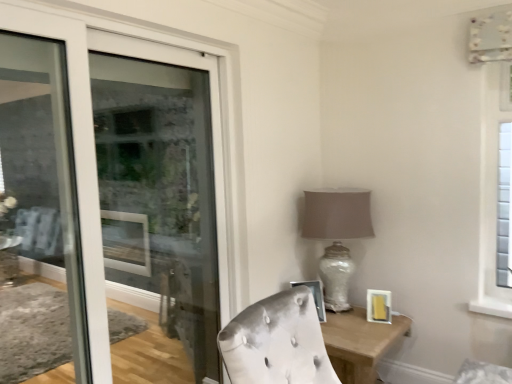
Measure the distance between point (354, 378) and camera.

A distance of 2.19 meters exists between point (354, 378) and camera.

This screenshot has width=512, height=384. Describe the element at coordinates (378, 306) in the screenshot. I see `matte gold picture frame at lower right, which is the 1th picture frame from right to left` at that location.

Measure the distance between metallic silver picture frame at center, arranged as the 2th picture frame when viewed from the right, and camera.

metallic silver picture frame at center, arranged as the 2th picture frame when viewed from the right, is 2.48 meters away from camera.

Image resolution: width=512 pixels, height=384 pixels. In order to click on wooden table at lower right in this screenshot , I will do tap(359, 343).

Identify the location of table that is under the matte glass door at left (from a real-world perspective). (359, 343).

From the image's perspective, would you say wooden table at lower right is positioned over matte glass door at left?

No, from the image's perspective, wooden table at lower right is not above matte glass door at left.

Are wooden table at lower right and matte glass door at left making contact?

There is a gap between wooden table at lower right and matte glass door at left.

Can we say wooden table at lower right lies outside matte glass door at left?

That's correct, wooden table at lower right is outside of matte glass door at left.

Is matte glass table lamp at center-right completely or partially outside of wooden table at lower right?

Yes, matte glass table lamp at center-right is located beyond the bounds of wooden table at lower right.

Is matte glass table lamp at center-right bigger than wooden table at lower right?

No.

From the image's perspective, is matte glass table lamp at center-right under wooden table at lower right?

No, from the image's perspective, matte glass table lamp at center-right is not beneath wooden table at lower right.

How different are the orientations of matte glass table lamp at center-right and wooden table at lower right in degrees?

There is a 1.27-degree angle between the facing directions of matte glass table lamp at center-right and wooden table at lower right.

Are matte glass door at left and matte glass table lamp at center-right located far from each other?

No, matte glass door at left is in close proximity to matte glass table lamp at center-right.

Considering the relative sizes of matte glass door at left and matte glass table lamp at center-right in the image provided, is matte glass door at left taller than matte glass table lamp at center-right?

Indeed, matte glass door at left has a greater height compared to matte glass table lamp at center-right.

From the image's perspective, which is below, matte glass door at left or matte glass table lamp at center-right?

matte glass table lamp at center-right, from the image's perspective.

Can we say matte glass door at left lies outside matte glass table lamp at center-right?

Yes, matte glass door at left is located beyond the bounds of matte glass table lamp at center-right.

Based on the photo, who is more distant, matte glass table lamp at center-right or matte gold picture frame at lower right, which is the 1th picture frame from right to left?

matte gold picture frame at lower right, which is the 1th picture frame from right to left, is further away from the camera.

Would you say matte glass table lamp at center-right is inside or outside matte gold picture frame at lower right, acting as the second picture frame starting from the left?

matte glass table lamp at center-right is not enclosed by matte gold picture frame at lower right, acting as the second picture frame starting from the left.

Is matte glass table lamp at center-right oriented towards matte gold picture frame at lower right, acting as the second picture frame starting from the left?

No, matte glass table lamp at center-right does not turn towards matte gold picture frame at lower right, acting as the second picture frame starting from the left.

Is matte glass table lamp at center-right wider or thinner than matte gold picture frame at lower right, acting as the second picture frame starting from the left?

Considering their sizes, matte glass table lamp at center-right looks broader than matte gold picture frame at lower right, acting as the second picture frame starting from the left.

Is metallic silver picture frame at center, arranged as the 2th picture frame when viewed from the right, with wooden table at lower right?

They are not placed beside each other.

Where is `the 2nd picture frame directly above the wooden table at lower right (from a real-world perspective)`? The width and height of the screenshot is (512, 384). the 2nd picture frame directly above the wooden table at lower right (from a real-world perspective) is located at coordinates (315, 297).

Who is smaller, metallic silver picture frame at center, arranged as the 2th picture frame when viewed from the right, or wooden table at lower right?

metallic silver picture frame at center, arranged as the 2th picture frame when viewed from the right, is smaller.

From a real-world perspective, which object stands above the other?

From a 3D spatial view, matte glass door at left is above.

Looking at this image, which is more distant, (97, 260) or (382, 295)?

Point (382, 295)

Is matte glass door at left not close to matte gold picture frame at lower right, acting as the second picture frame starting from the left?

matte glass door at left is far away from matte gold picture frame at lower right, acting as the second picture frame starting from the left.

Looking at their sizes, would you say matte glass door at left is wider or thinner than matte gold picture frame at lower right, acting as the second picture frame starting from the left?

In the image, matte glass door at left appears to be more narrow than matte gold picture frame at lower right, acting as the second picture frame starting from the left.

In order to click on the 1st picture frame positioned below the matte glass door at left (from a real-world perspective) in this screenshot , I will do `click(315, 297)`.

From a real-world perspective, is metallic silver picture frame at center, which is the 1th picture frame in left-to-right order, on matte glass door at left?

No.

Is metallic silver picture frame at center, arranged as the 2th picture frame when viewed from the right, at the right side of matte glass door at left?

Correct, you'll find metallic silver picture frame at center, arranged as the 2th picture frame when viewed from the right, to the right of matte glass door at left.

Where is `door on the left of wooden table at lower right`? The height and width of the screenshot is (384, 512). door on the left of wooden table at lower right is located at coordinates (94, 144).

Find the location of a particular element. The width and height of the screenshot is (512, 384). table below the matte glass table lamp at center-right (from a real-world perspective) is located at coordinates (359, 343).

Considering their positions, is wooden table at lower right positioned closer to matte gold picture frame at lower right, acting as the second picture frame starting from the left, than matte glass table lamp at center-right?

wooden table at lower right is positioned closer to the anchor matte gold picture frame at lower right, acting as the second picture frame starting from the left.

Looking at the image, which one is located closer to wooden table at lower right, matte glass door at left or matte gold picture frame at lower right, which is the 1th picture frame from right to left?

Among the two, matte gold picture frame at lower right, which is the 1th picture frame from right to left, is located nearer to wooden table at lower right.

When comparing their distances from metallic silver picture frame at center, which is the 1th picture frame in left-to-right order, does wooden table at lower right or matte glass door at left seem closer?

Based on the image, wooden table at lower right appears to be nearer to metallic silver picture frame at center, which is the 1th picture frame in left-to-right order.

Based on their spatial positions, is metallic silver picture frame at center, which is the 1th picture frame in left-to-right order, or wooden table at lower right closer to matte gold picture frame at lower right, acting as the second picture frame starting from the left?

wooden table at lower right is closer to matte gold picture frame at lower right, acting as the second picture frame starting from the left.

From the image, which object appears to be farther from matte glass table lamp at center-right, metallic silver picture frame at center, arranged as the 2th picture frame when viewed from the right, or wooden table at lower right?

wooden table at lower right is positioned further to the anchor matte glass table lamp at center-right.

Which object lies nearer to the anchor point matte gold picture frame at lower right, which is the 1th picture frame from right to left, wooden table at lower right or matte glass door at left?

wooden table at lower right is closer to matte gold picture frame at lower right, which is the 1th picture frame from right to left.

Looking at the image, which one is located further to wooden table at lower right, matte glass table lamp at center-right or matte gold picture frame at lower right, which is the 1th picture frame from right to left?

matte glass table lamp at center-right lies further to wooden table at lower right than the other object.

Based on their spatial positions, is matte glass door at left or wooden table at lower right further from matte gold picture frame at lower right, which is the 1th picture frame from right to left?

The object further to matte gold picture frame at lower right, which is the 1th picture frame from right to left, is matte glass door at left.

The height and width of the screenshot is (384, 512). Find the location of `table between matte glass door at left and matte glass table lamp at center-right along the z-axis`. table between matte glass door at left and matte glass table lamp at center-right along the z-axis is located at coordinates (359, 343).

The width and height of the screenshot is (512, 384). Identify the location of table situated between metallic silver picture frame at center, which is the 1th picture frame in left-to-right order, and matte gold picture frame at lower right, acting as the second picture frame starting from the left, from left to right. (359, 343).

Locate an element on the screen. table lamp between matte glass door at left and matte gold picture frame at lower right, which is the 1th picture frame from right to left, in the front-back direction is located at coordinates coord(337,214).

Image resolution: width=512 pixels, height=384 pixels. Identify the location of table situated between matte glass door at left and matte gold picture frame at lower right, acting as the second picture frame starting from the left, from left to right. (359, 343).